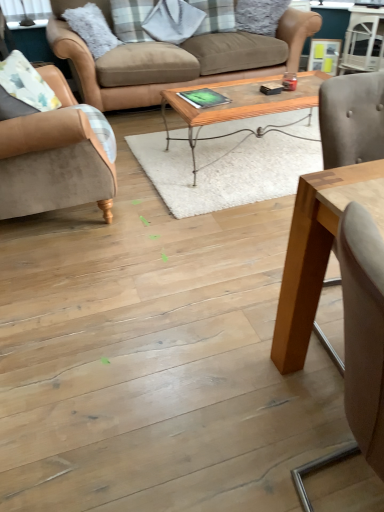
Question: Is light brown wood swivel chair at right inside suede beige armchair at left?

Choices:
 (A) no
 (B) yes

Answer: (A)

Question: From the image's perspective, is suede beige armchair at left located beneath light brown wood swivel chair at right?

Choices:
 (A) no
 (B) yes

Answer: (A)

Question: Is suede beige armchair at left shorter than light brown wood swivel chair at right?

Choices:
 (A) no
 (B) yes

Answer: (B)

Question: Is suede beige armchair at left taller than light brown wood swivel chair at right?

Choices:
 (A) yes
 (B) no

Answer: (B)

Question: From the image's perspective, would you say suede beige armchair at left is positioned over light brown wood swivel chair at right?

Choices:
 (A) no
 (B) yes

Answer: (B)

Question: Is suede beige armchair at left turned away from light brown wood swivel chair at right?

Choices:
 (A) yes
 (B) no

Answer: (B)

Question: Would you say light brown wood swivel chair at right is outside brown leather couch at upper center?

Choices:
 (A) yes
 (B) no

Answer: (A)

Question: Does light brown wood swivel chair at right appear on the right side of brown leather couch at upper center?

Choices:
 (A) yes
 (B) no

Answer: (A)

Question: From the image's perspective, does light brown wood swivel chair at right appear higher than brown leather couch at upper center?

Choices:
 (A) yes
 (B) no

Answer: (B)

Question: Is light brown wood swivel chair at right thinner than brown leather couch at upper center?

Choices:
 (A) yes
 (B) no

Answer: (A)

Question: Does light brown wood swivel chair at right have a lesser height compared to brown leather couch at upper center?

Choices:
 (A) no
 (B) yes

Answer: (A)

Question: From a real-world perspective, is light brown wood swivel chair at right on top of brown leather couch at upper center?

Choices:
 (A) no
 (B) yes

Answer: (B)

Question: Is woodenwoodencoffee table at center, placed as the first coffee table when sorted from top to bottom, placed right next to suede beige armchair at left?

Choices:
 (A) no
 (B) yes

Answer: (A)